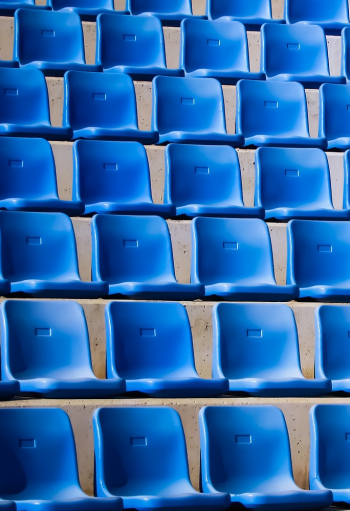
Locate an element on the screen. The height and width of the screenshot is (511, 350). seating on the far left side is located at coordinates (18, 2), (43, 22), (16, 103), (23, 169), (33, 230), (49, 319), (31, 438).